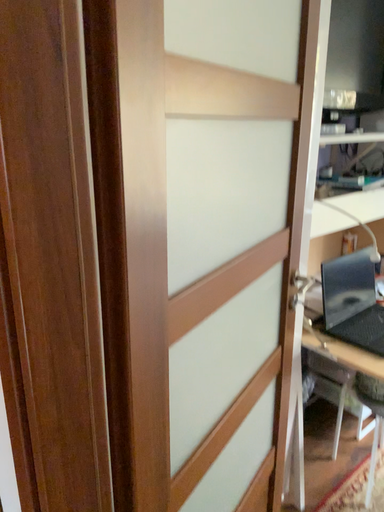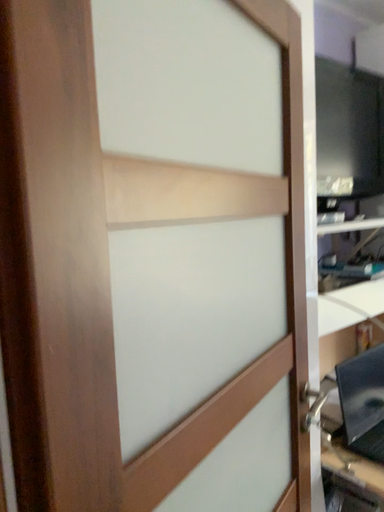
Question: How did the camera likely rotate when shooting the video?

Choices:
 (A) rotated downward
 (B) rotated upward

Answer: (B)